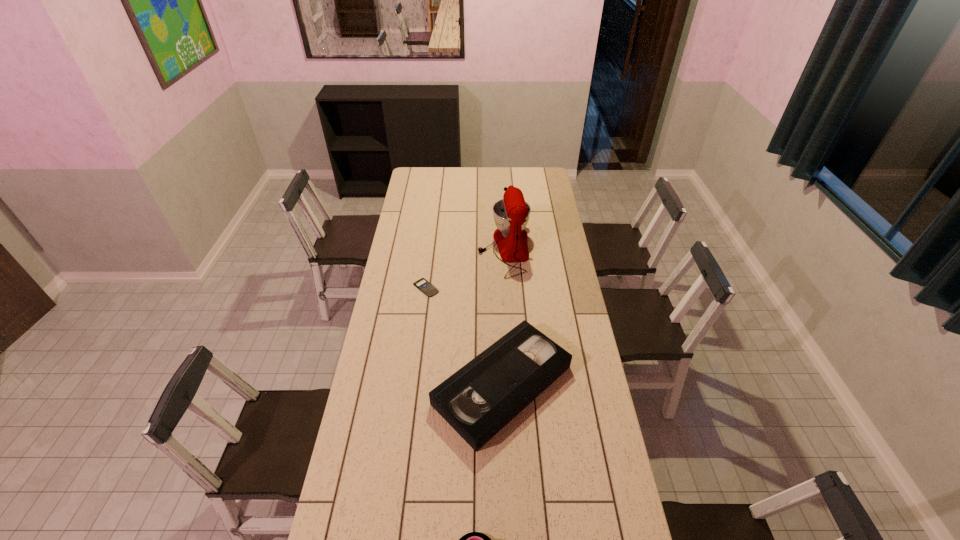
You are a GUI agent. You are given a task and a screenshot of the screen. Output one action in this format:
    pyautogui.click(x=<x>, y=<y>)
    Task: Click on the object that is the third closest to the shortest object
    
    Given the screenshot: What is the action you would take?
    pyautogui.click(x=473, y=539)

Where is `free space that satisfies the following two spatial constraints: 1. on the bowl side of the tallest object; 2. on the front side of the shortest object`? Image resolution: width=960 pixels, height=540 pixels. free space that satisfies the following two spatial constraints: 1. on the bowl side of the tallest object; 2. on the front side of the shortest object is located at coordinates point(507,288).

The image size is (960, 540). Find the location of `vacant region that satisfies the following two spatial constraints: 1. on the bowl side of the tallest object; 2. on the front side of the second nearest object`. vacant region that satisfies the following two spatial constraints: 1. on the bowl side of the tallest object; 2. on the front side of the second nearest object is located at coordinates (513, 385).

Locate an element on the screen. The height and width of the screenshot is (540, 960). blank space that satisfies the following two spatial constraints: 1. on the bowl side of the tallest object; 2. on the front side of the leftmost object is located at coordinates (507, 288).

At what (x,y) coordinates should I click in order to perform the action: click on vacant area that satisfies the following two spatial constraints: 1. on the bowl side of the mixer; 2. on the front side of the videotape. Please return your answer as a coordinate pair (x, y). Image resolution: width=960 pixels, height=540 pixels. Looking at the image, I should click on (513, 385).

The width and height of the screenshot is (960, 540). Find the location of `vacant area that satisfies the following two spatial constraints: 1. on the front side of the leftmost object; 2. on the left side of the videotape`. vacant area that satisfies the following two spatial constraints: 1. on the front side of the leftmost object; 2. on the left side of the videotape is located at coordinates (414, 385).